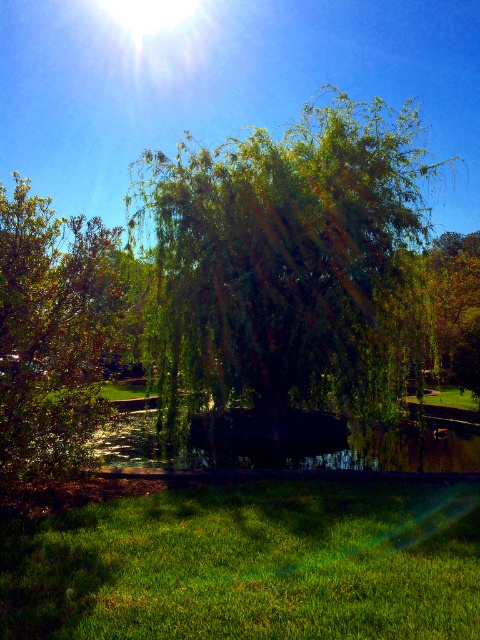
Which is below, green leafy willow at center or green leafy tree at center?

Positioned lower is green leafy tree at center.

Can you confirm if green leafy willow at center is taller than green leafy tree at center?

Yes.

Which is behind, point (183, 294) or point (463, 262)?

Point (463, 262)

The height and width of the screenshot is (640, 480). What are the coordinates of `green leafy willow at center` in the screenshot? It's located at (288, 278).

Who is shorter, green leafy willow at center or green leafy tree at left?

With less height is green leafy tree at left.

Can you confirm if green leafy willow at center is positioned below green leafy tree at left?

No, green leafy willow at center is not below green leafy tree at left.

Is point (299, 148) more distant than point (43, 314)?

Yes.

The image size is (480, 640). What are the coordinates of `green leafy willow at center` in the screenshot? It's located at (288, 278).

Which is above, green leafy willow at center or green grassy at lower center?

Positioned higher is green leafy willow at center.

Does green leafy willow at center have a lesser width compared to green grassy at lower center?

No.

At what (x,y) coordinates should I click in order to perform the action: click on green leafy willow at center. Please return your answer as a coordinate pair (x, y). The width and height of the screenshot is (480, 640). Looking at the image, I should click on (288, 278).